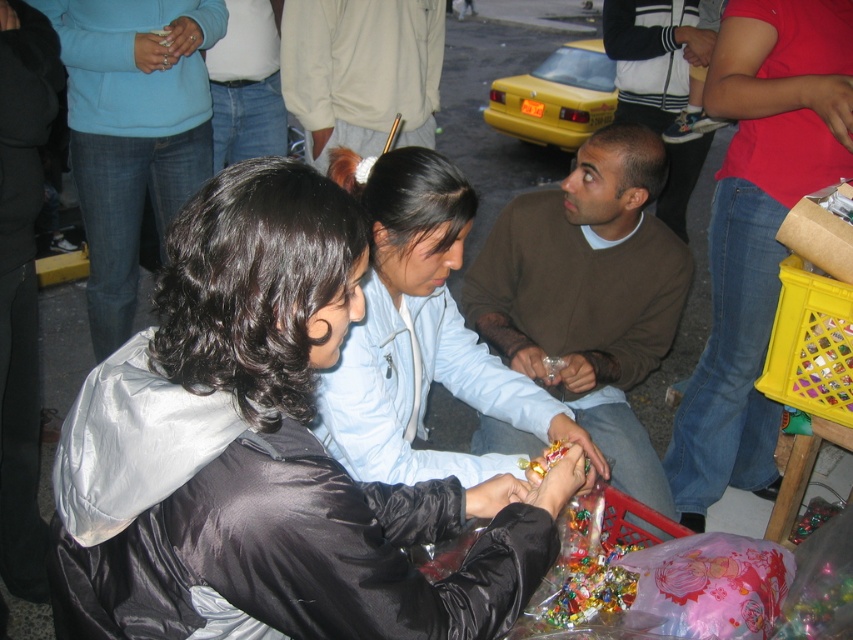
You are a photographer standing in the middle of the street scene. You want to take a photo that includes both the denim jeans at lower right and the light beige sweater at center. Which object should you adjust your camera angle to focus on first to ensure both are in frame?

The denim jeans at lower right is positioned on the right side of light beige sweater at center. To include both in the frame, focus on the light beige sweater at center first, then adjust to include the denim jeans at lower right on its right side.

You are a photographer trying to capture a group photo of the light blue jacket at center and the yellow matte taxi at upper center. Which one of these two objects would require you to zoom out more to include both in the frame?

The yellow matte taxi at upper center is wider than the light blue jacket at center, so you would need to zoom out more to include both the light blue jacket at center and the yellow matte taxi at upper center in the frame.